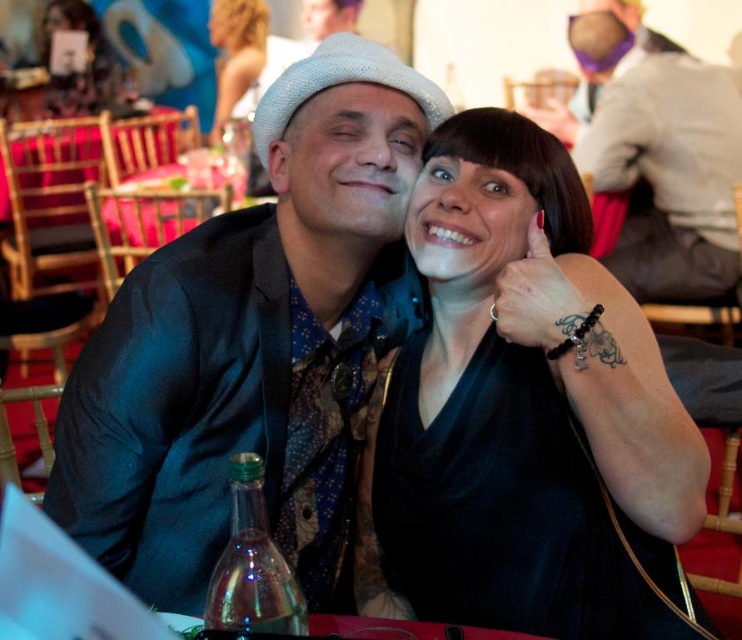
Question: Which of the following is the closest to the observer?

Choices:
 (A) (462, 468)
 (B) (193, 362)

Answer: (A)

Question: Is the position of black matte dress at center less distant than that of matte black jacket at upper center?

Choices:
 (A) no
 (B) yes

Answer: (B)

Question: Does satin black suit at center have a larger size compared to matte black jacket at upper center?

Choices:
 (A) no
 (B) yes

Answer: (A)

Question: Among these points, which one is nearest to the camera?

Choices:
 (A) (164, 330)
 (B) (565, 506)

Answer: (B)

Question: Is satin black suit at center below matte black jacket at upper center?

Choices:
 (A) yes
 (B) no

Answer: (A)

Question: Which object appears closest to the camera in this image?

Choices:
 (A) matte black jacket at upper center
 (B) black matte dress at center
 (C) satin black suit at center

Answer: (B)